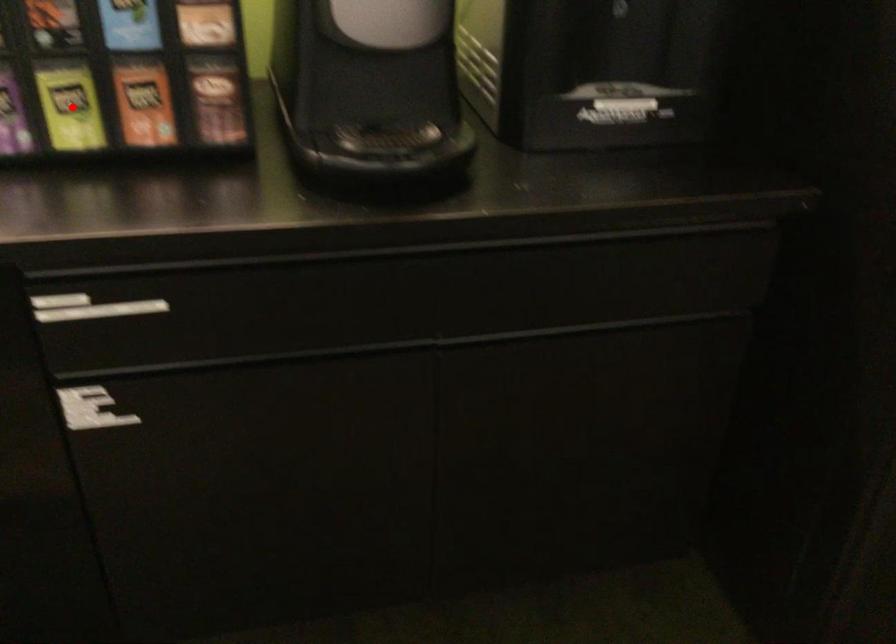
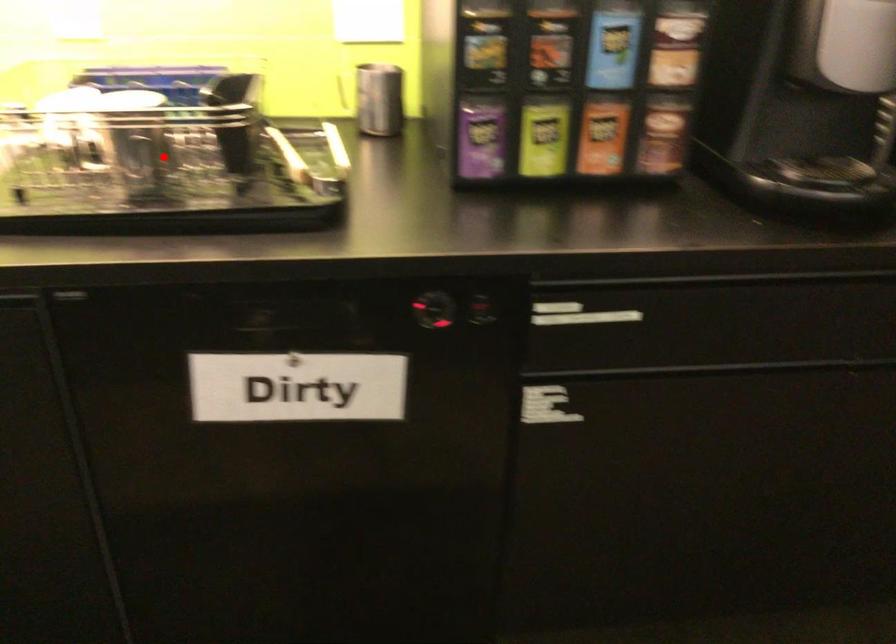
I am providing you with two images of the same scene from different viewpoints. A red point is marked on the first image and another point is marked on the second image. Do the highlighted points in image1 and image2 indicate the same real-world spot?

No